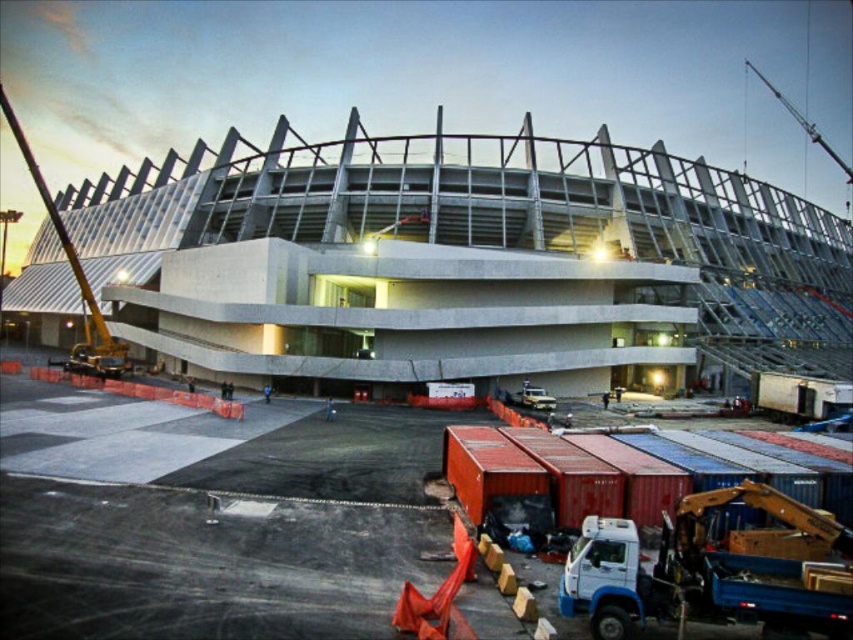
You are a construction worker standing at the orange container at center. You need to move to the concrete stadium at center for an inspection. Which direction should you walk to reach it?

The concrete stadium at center is to the right of the orange container at center, so you should walk to the right to reach it.

You are a construction worker who needs to move a large piece of equipment that is 10 meters in length. You are standing near the orange container at center. Is there enough space to maneuver the equipment around the concrete stadium at center?

The concrete stadium at center is bigger than the orange container at center. Since the stadium is larger, there should be sufficient space to maneuver the 10 meter equipment around it, provided the surrounding area is clear of obstructions.